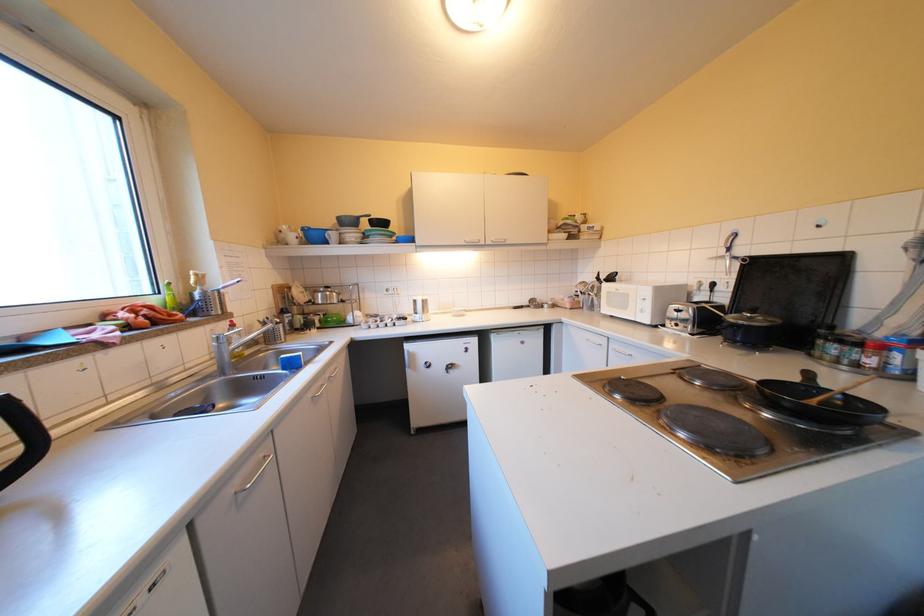
Which object does [872,355] point to?

It refers to a red cap spice jar.